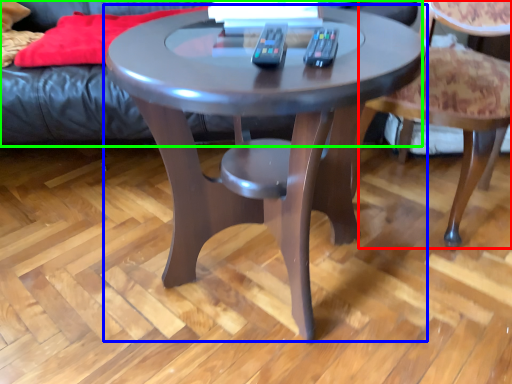
Question: Which object is the farthest from chair (highlighted by a red box)? Choose among these: coffee table (highlighted by a blue box) or couch (highlighted by a green box).

Choices:
 (A) coffee table
 (B) couch

Answer: (B)